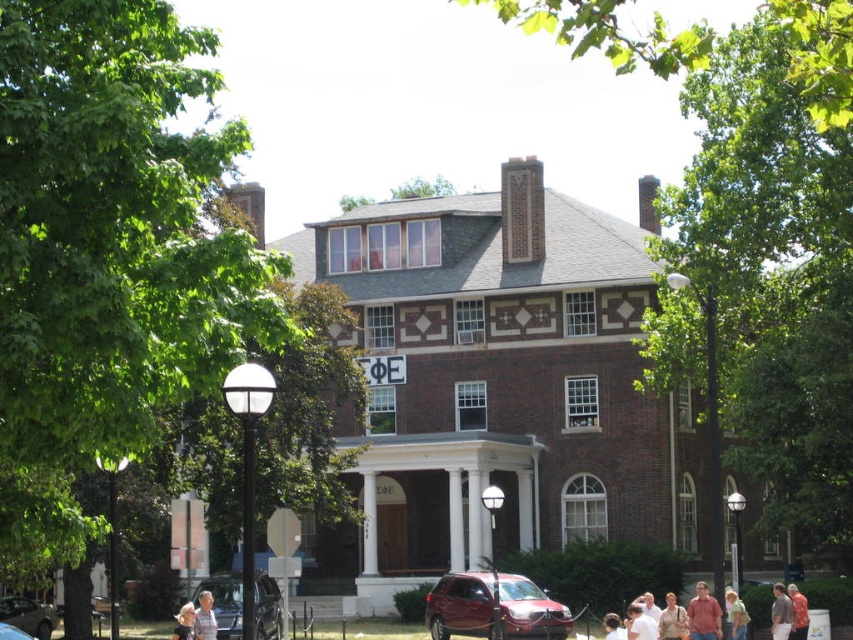
Based on the photo, does metallic silver car at lower left appear under light brown shirt at center?

Yes, metallic silver car at lower left is below light brown shirt at center.

Does metallic silver car at lower left have a greater height compared to light brown shirt at center?

Yes, metallic silver car at lower left is taller than light brown shirt at center.

Locate an element on the screen. This screenshot has width=853, height=640. metallic silver car at lower left is located at coordinates (28, 616).

The image size is (853, 640). What are the coordinates of `metallic silver car at lower left` in the screenshot? It's located at (28, 616).

Is light brown hair at lower center in front of light blue shirt at center?

Yes, it is.

Is point (650, 621) positioned behind point (733, 630)?

No.

Does point (650, 628) lie behind point (730, 634)?

No, (650, 628) is in front of (730, 634).

You are a GUI agent. You are given a task and a screenshot of the screen. Output one action in this format:
    pyautogui.click(x=<x>, y=<y>)
    Task: Click on the light brown hair at lower center
    This screenshot has width=853, height=640.
    Given the screenshot: What is the action you would take?
    pyautogui.click(x=640, y=624)

Does gray fabric shirt at lower left have a lesser width compared to blonde hair at lower left?

Yes, gray fabric shirt at lower left is thinner than blonde hair at lower left.

Image resolution: width=853 pixels, height=640 pixels. What do you see at coordinates (204, 618) in the screenshot?
I see `gray fabric shirt at lower left` at bounding box center [204, 618].

Who is more forward, [212,628] or [183,637]?

Point [183,637] is in front.

Locate an element on the screen. Image resolution: width=853 pixels, height=640 pixels. gray fabric shirt at lower left is located at coordinates (204, 618).